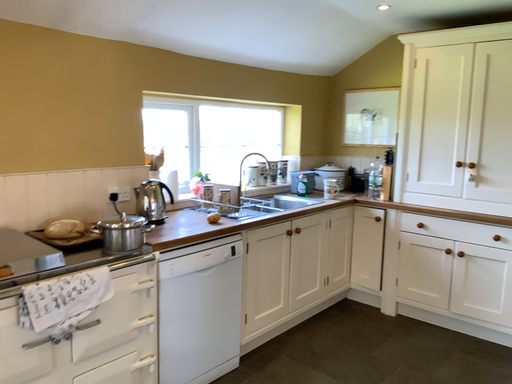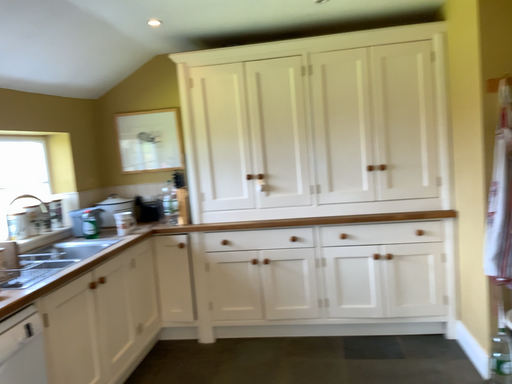
Question: Which way did the camera rotate in the video?

Choices:
 (A) rotated left
 (B) rotated right

Answer: (B)